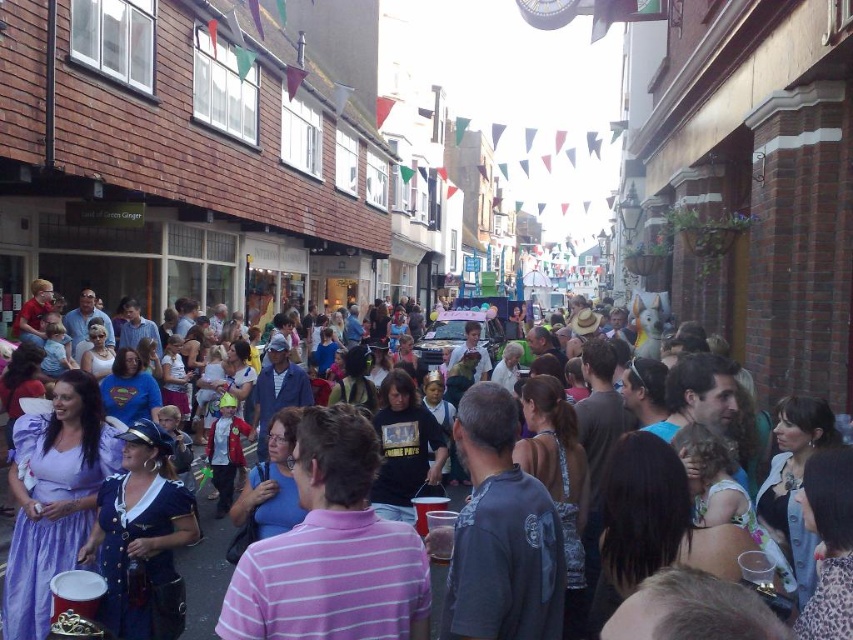
From the picture: Can you confirm if pink striped shirt at center is shorter than matte plastic cup at center?

Yes.

I want to click on pink striped shirt at center, so click(331, 550).